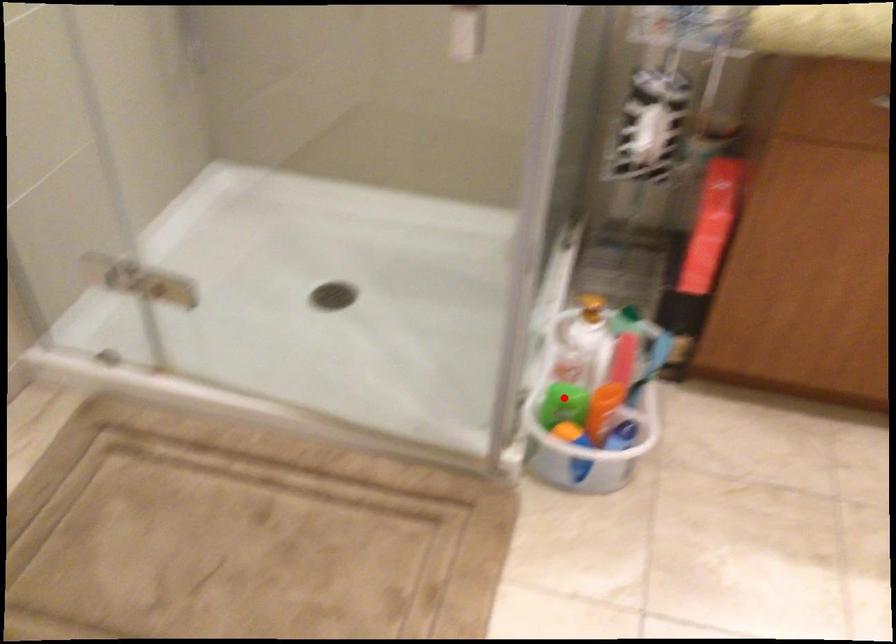
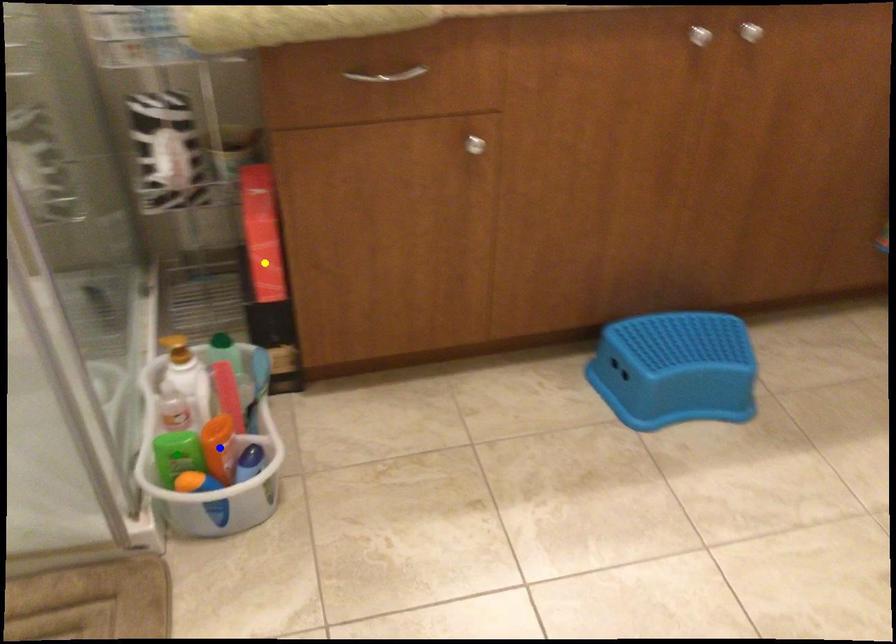
Question: I am providing you with two images of the same scene from different viewpoints. A red point is marked on the first image. You are given multiple points on the second image. Which point in image 2 is actually the same real-world point as the red point in image 1?

Choices:
 (A) blue point
 (B) green point
 (C) yellow point

Answer: (B)